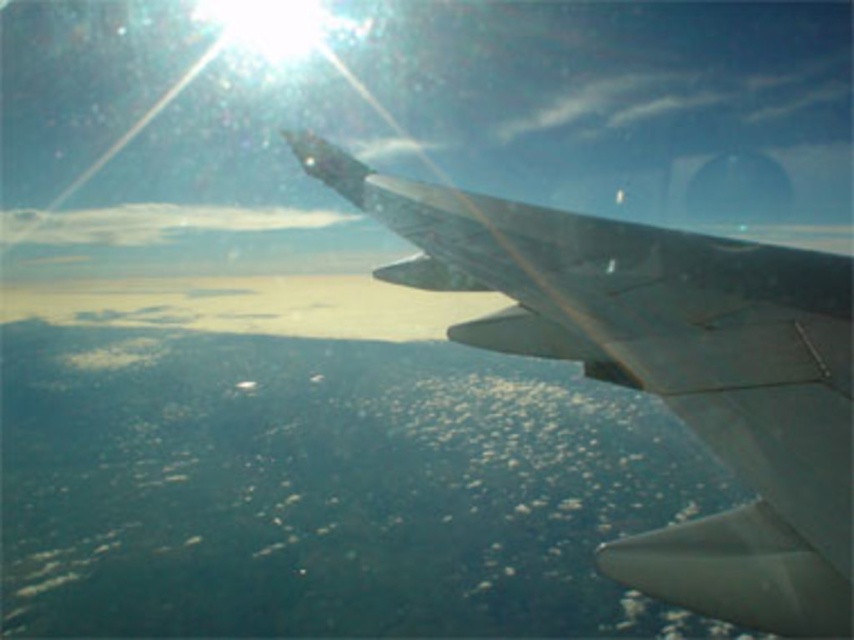
Is metallic gray wing at upper right shorter than white fluffy cloud at upper left?

Yes.

Is point (621, 324) closer to viewer compared to point (127, 237)?

Yes, it is in front of point (127, 237).

Does point (835, 586) come farther from viewer compared to point (294, 212)?

No, it is in front of (294, 212).

Locate an element on the screen. Image resolution: width=854 pixels, height=640 pixels. metallic gray wing at upper right is located at coordinates (667, 371).